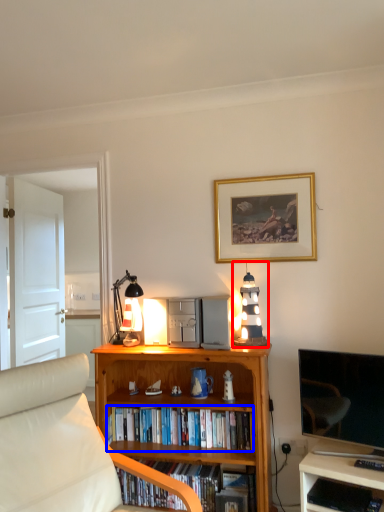
Question: Which of the following is the closest to the observer, lamp (highlighted by a red box) or book (highlighted by a blue box)?

Choices:
 (A) lamp
 (B) book

Answer: (B)